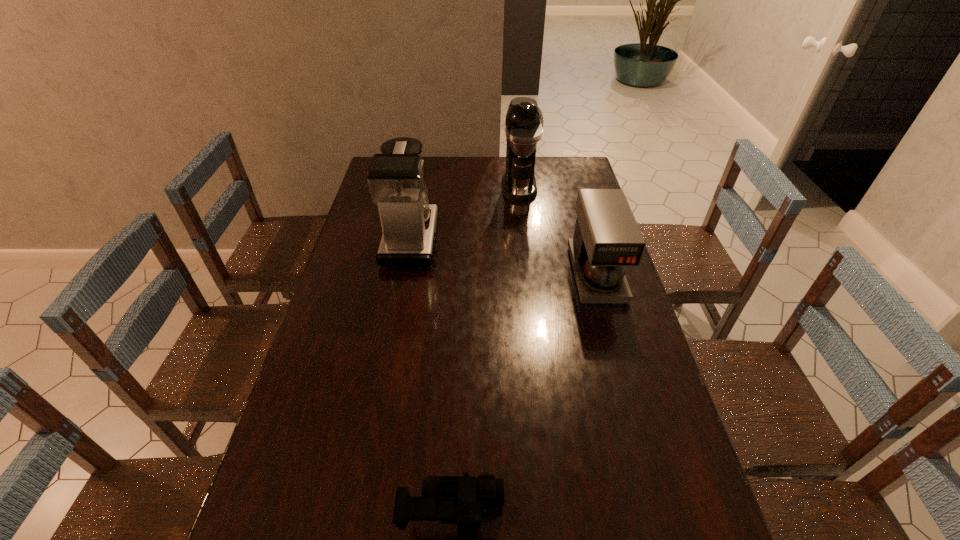
Find the location of `object located in the right edge section of the desktop`. object located in the right edge section of the desktop is located at coordinates (607, 238).

This screenshot has width=960, height=540. I want to click on free space at the far edge of the desktop, so point(462,166).

In the image, there is a desktop. In order to click on vacant space at the left edge in this screenshot , I will do `click(363, 359)`.

Where is `free spot at the right edge of the desktop`? The width and height of the screenshot is (960, 540). free spot at the right edge of the desktop is located at coordinates (620, 383).

Identify the location of free spot between the third object from left to right and the rightmost coffee maker. (558, 230).

You are a GUI agent. You are given a task and a screenshot of the screen. Output one action in this format:
    pyautogui.click(x=<x>, y=<y>)
    Task: Click on the blank region between the rightmost coffee maker and the leftmost coffee maker
    The height and width of the screenshot is (540, 960).
    Given the screenshot: What is the action you would take?
    pyautogui.click(x=504, y=256)

Where is `free space between the leftmost coffee maker and the third object from left to right`? free space between the leftmost coffee maker and the third object from left to right is located at coordinates (466, 213).

Locate an element on the screen. Image resolution: width=960 pixels, height=540 pixels. empty space that is in between the leftmost coffee maker and the second shortest object is located at coordinates (504, 256).

Where is `empty space that is in between the second shortest object and the third object from left to right`? empty space that is in between the second shortest object and the third object from left to right is located at coordinates [558, 230].

You are a GUI agent. You are given a task and a screenshot of the screen. Output one action in this format:
    pyautogui.click(x=<x>, y=<y>)
    Task: Click on the empty location between the rightmost object and the leftmost coffee maker
    
    Given the screenshot: What is the action you would take?
    click(504, 256)